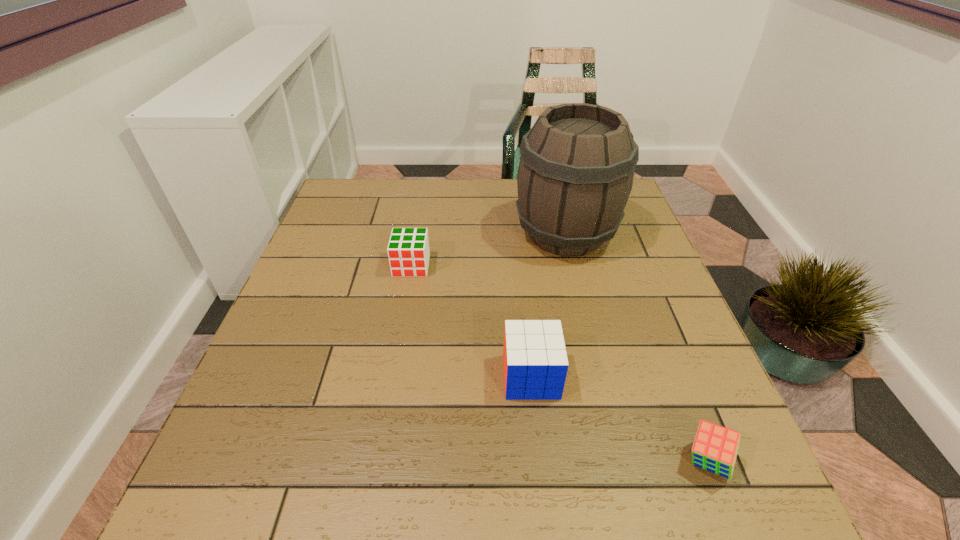
Where is `vacant area that lies between the leftmost object and the wine bucket`? Image resolution: width=960 pixels, height=540 pixels. vacant area that lies between the leftmost object and the wine bucket is located at coordinates (489, 250).

This screenshot has width=960, height=540. In order to click on unoccupied position between the leftmost object and the second nearest cube in this screenshot , I will do tap(471, 321).

Where is `free spot between the tallest object and the nearest object`? The width and height of the screenshot is (960, 540). free spot between the tallest object and the nearest object is located at coordinates (636, 348).

The image size is (960, 540). I want to click on unoccupied position between the second cube from left to right and the farthest cube, so click(x=471, y=321).

Identify which object is located as the third nearest to the rightmost cube. Please provide its 2D coordinates. Your answer should be formatted as a tuple, i.e. [(x, y)], where the tuple contains the x and y coordinates of a point satisfying the conditions above.

[(408, 250)]

You are a GUI agent. You are given a task and a screenshot of the screen. Output one action in this format:
    pyautogui.click(x=<x>, y=<y>)
    Task: Click on the closest object relative to the farthest cube
    Image resolution: width=960 pixels, height=540 pixels.
    Given the screenshot: What is the action you would take?
    pyautogui.click(x=576, y=169)

Find the location of a particular element. The width and height of the screenshot is (960, 540). cube that stands as the closest to the tallest cube is located at coordinates (715, 448).

This screenshot has width=960, height=540. I want to click on cube that stands as the second closest to the farthest cube, so click(x=715, y=448).

Find the location of a particular element. Image resolution: width=960 pixels, height=540 pixels. vacant space that satisfies the following two spatial constraints: 1. on the front side of the nearest cube; 2. on the left side of the second tallest object is located at coordinates (540, 461).

The width and height of the screenshot is (960, 540). What are the coordinates of `vacant region that satisfies the following two spatial constraints: 1. on the red face of the tallest cube; 2. on the right side of the leftmost cube` in the screenshot? It's located at (392, 376).